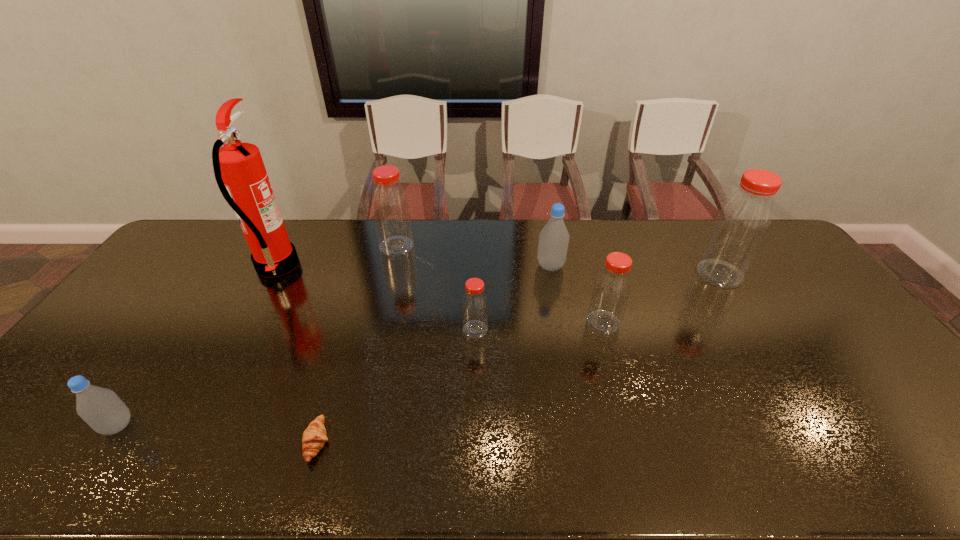
Identify which object is the sixth closest to the third nearest red bottle. Please provide its 2D coordinates. Your answer should be formatted as a tuple, i.e. [(x, y)], where the tuple contains the x and y coordinates of a point satisfying the conditions above.

[(239, 170)]

Identify the location of the sixth closest bottle relative to the shortest object. The width and height of the screenshot is (960, 540). (743, 221).

Locate which bottle is the second closest to the second bottle from left to right. Please provide its 2D coordinates. Your answer should be formatted as a tuple, i.e. [(x, y)], where the tuple contains the x and y coordinates of a point satisfying the conditions above.

[(553, 243)]

Image resolution: width=960 pixels, height=540 pixels. I want to click on red bottle that is the closest to the right gray bottle, so click(612, 287).

Identify which red bottle is the nearest to the pastry. Please provide its 2D coordinates. Your answer should be formatted as a tuple, i.e. [(x, y)], where the tuple contains the x and y coordinates of a point satisfying the conditions above.

[(474, 302)]

Image resolution: width=960 pixels, height=540 pixels. What are the coordinates of `vacant region that satisfies the following two spatial constraints: 1. with the nozzle aimed from the tallest object; 2. on the left side of the biggest red bottle` in the screenshot? It's located at tap(273, 274).

Identify the location of vacant space that satisfies the following two spatial constraints: 1. on the back side of the second red bottle from right to left; 2. on the left side of the tallest bottle. (589, 274).

The image size is (960, 540). I want to click on free space that satisfies the following two spatial constraints: 1. with the nozzle aimed from the tallest object; 2. on the back side of the second red bottle from left to right, so click(x=242, y=330).

Image resolution: width=960 pixels, height=540 pixels. Identify the location of vacant space that satisfies the following two spatial constraints: 1. with the nozzle aimed from the rightmost red bottle; 2. on the right side of the fire extinguisher. (273, 274).

Locate an element on the screen. The height and width of the screenshot is (540, 960). vacant space that satisfies the following two spatial constraints: 1. with the nozzle aimed from the second object from left to right; 2. on the front side of the left gray bottle is located at coordinates (189, 426).